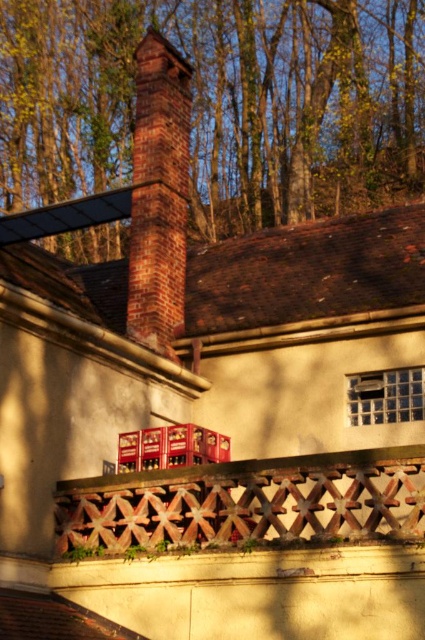
Question: Which object is positioned closest to the red brick chimney at center?

Choices:
 (A) wooden lattice at center
 (B) brown wood tree at upper center

Answer: (A)

Question: Which object is positioned closest to the red brick chimney at center?

Choices:
 (A) wooden lattice at center
 (B) brown wood tree at upper center

Answer: (A)

Question: Does brown wood tree at upper center appear under red brick chimney at center?

Choices:
 (A) yes
 (B) no

Answer: (B)

Question: Considering the real-world distances, which object is farthest from the red brick chimney at center?

Choices:
 (A) brown wood tree at upper center
 (B) wooden lattice at center

Answer: (A)

Question: Does brown wood tree at upper center appear under red brick chimney at center?

Choices:
 (A) yes
 (B) no

Answer: (B)

Question: Can you confirm if brown wood tree at upper center is thinner than wooden lattice at center?

Choices:
 (A) no
 (B) yes

Answer: (A)